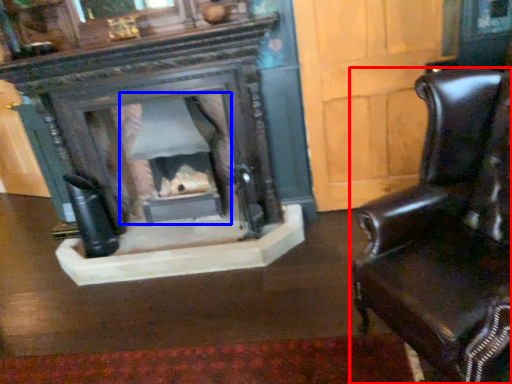
Question: Which of the following is the closest to the observer, chair (highlighted by a red box) or fireplace (highlighted by a blue box)?

Choices:
 (A) chair
 (B) fireplace

Answer: (A)